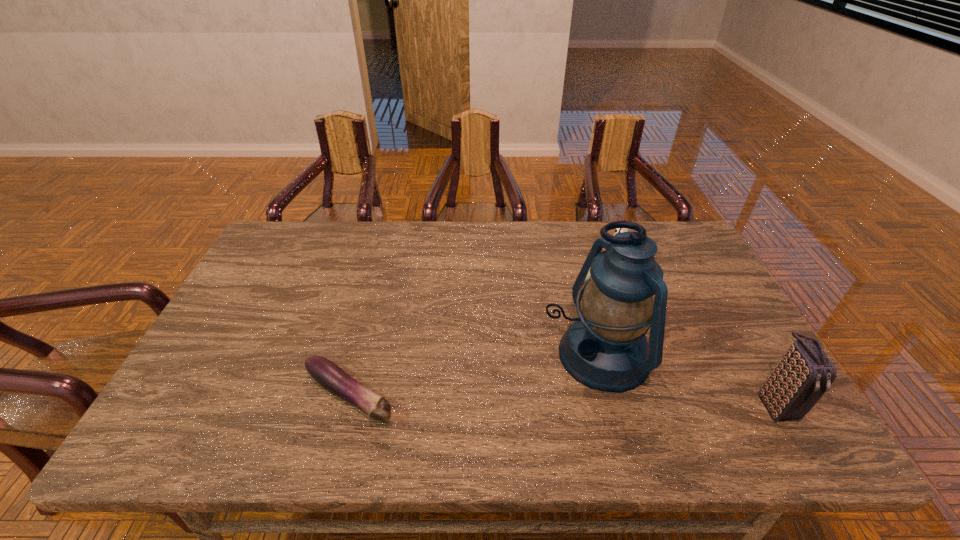
You are a GUI agent. You are given a task and a screenshot of the screen. Output one action in this format:
    pyautogui.click(x=<x>, y=<y>)
    Task: Click on the free area in between the eggplant and the bird
    The width and height of the screenshot is (960, 540).
    Given the screenshot: What is the action you would take?
    pyautogui.click(x=486, y=328)

Locate an element on the screen. The height and width of the screenshot is (540, 960). free area in between the bird and the leftmost object is located at coordinates (486, 328).

This screenshot has width=960, height=540. I want to click on vacant area that lies between the tallest object and the clutch bag, so click(686, 380).

This screenshot has height=540, width=960. Find the location of `object that stands as the third closest to the eggplant`. object that stands as the third closest to the eggplant is located at coordinates (802, 376).

Identify which object is the second nearest to the rightmost object. Please provide its 2D coordinates. Your answer should be formatted as a tuple, i.e. [(x, y)], where the tuple contains the x and y coordinates of a point satisfying the conditions above.

[(619, 230)]

Identify the location of free space that satisfies the following two spatial constraints: 1. on the back side of the shortest object; 2. on the left side of the tallest object. This screenshot has width=960, height=540. (360, 355).